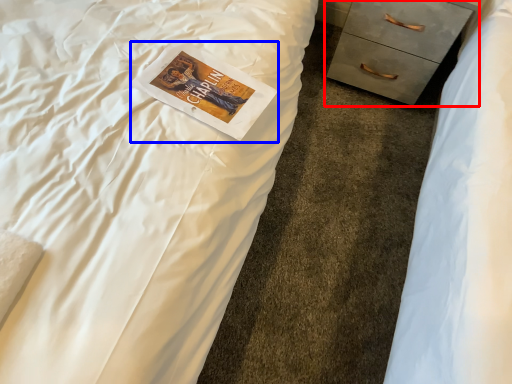
Question: Which object is further to the camera taking this photo, chest of drawers (highlighted by a red box) or paperback book (highlighted by a blue box)?

Choices:
 (A) chest of drawers
 (B) paperback book

Answer: (A)